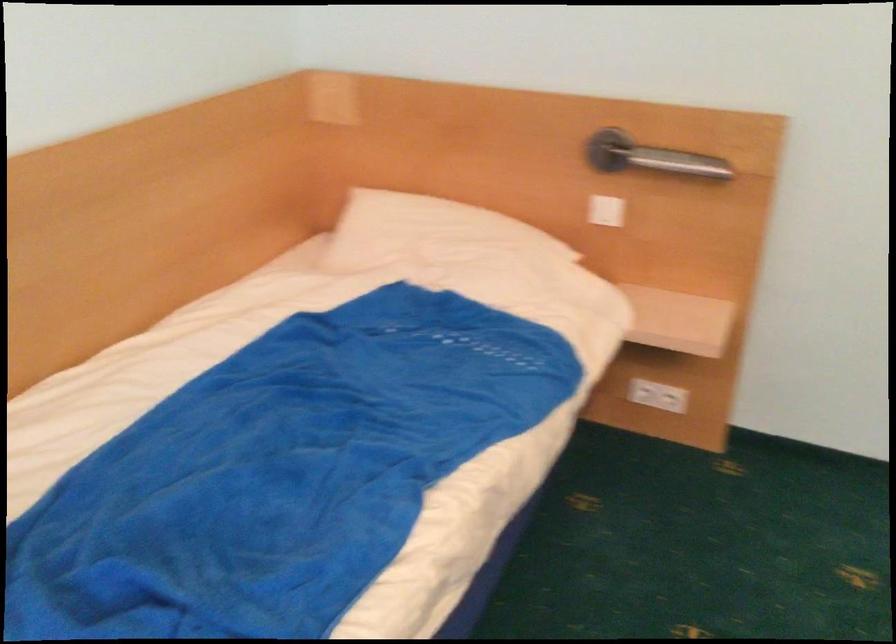
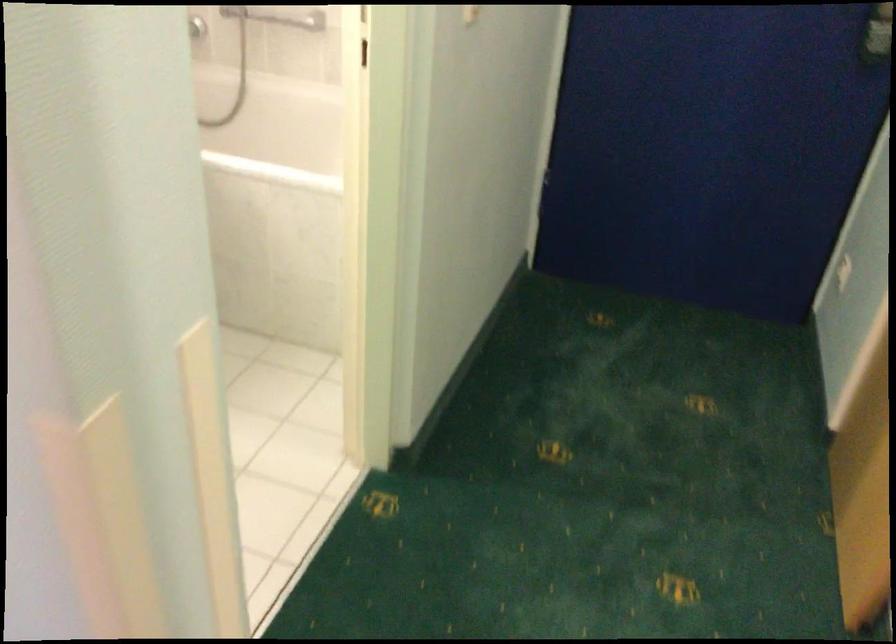
In a continuous first-person perspective shot, in which direction is the camera moving?

The cameraman walked toward right, forward.